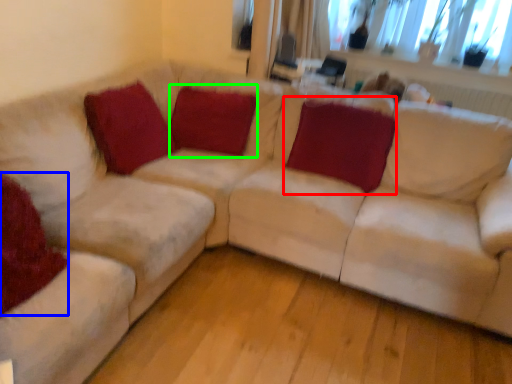
Question: Which is nearer to the pillow (highlighted by a red box)? pillow (highlighted by a blue box) or pillow (highlighted by a green box).

Choices:
 (A) pillow
 (B) pillow

Answer: (B)